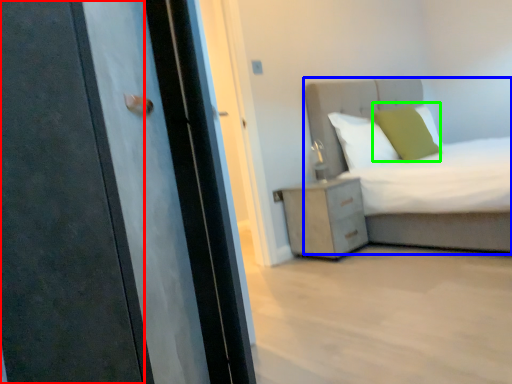
Question: Which object is positioned farthest from door (highlighted by a red box)? Select from bed (highlighted by a blue box) and pillow (highlighted by a green box).

Choices:
 (A) bed
 (B) pillow

Answer: (B)